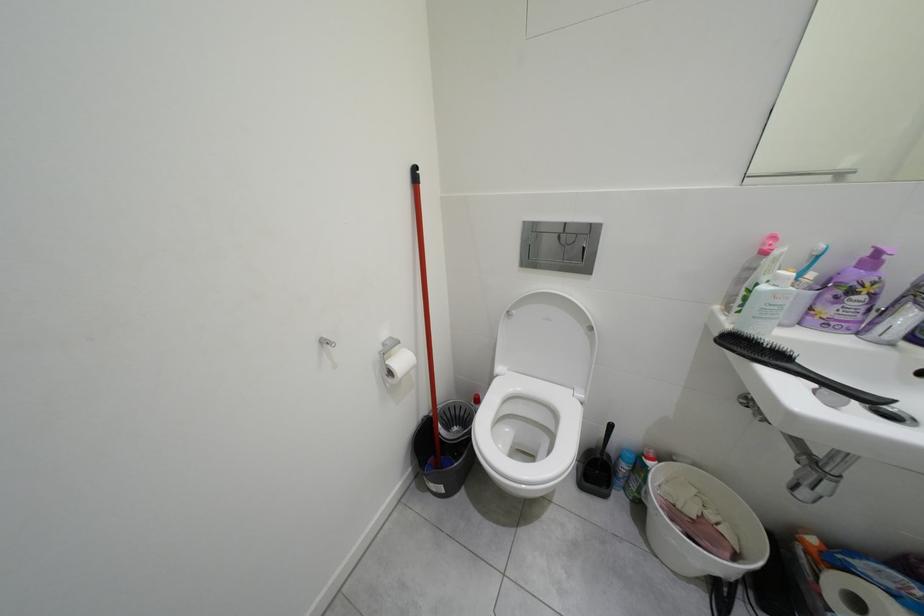
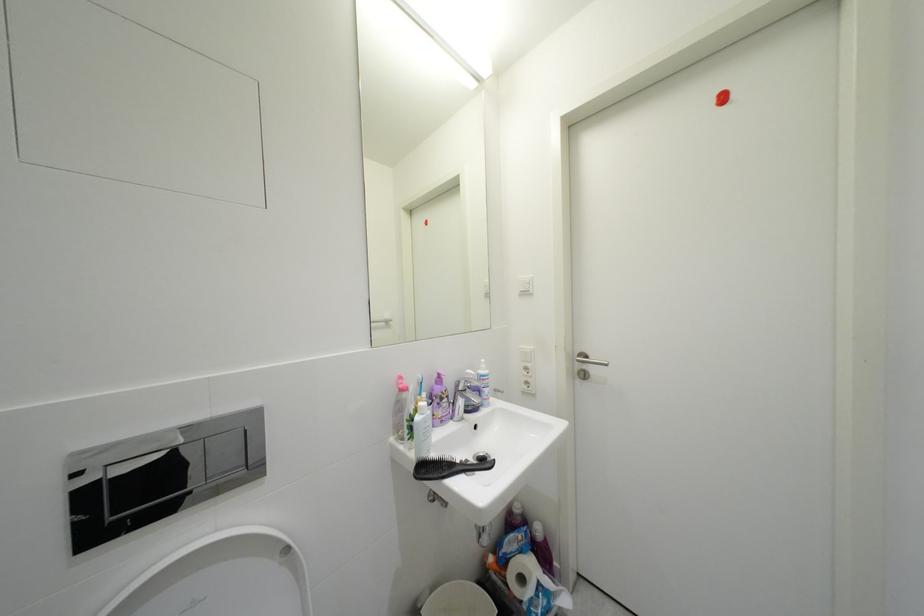
Question: The first image is from the beginning of the video and the second image is from the end. How did the camera likely rotate when shooting the video?

Choices:
 (A) Left
 (B) Right
 (C) Up
 (D) Down

Answer: (B)